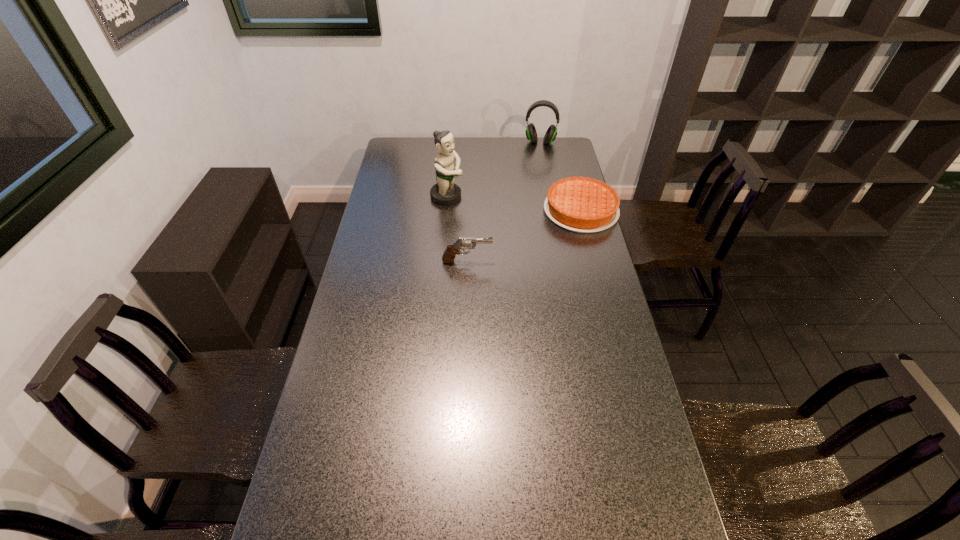
The height and width of the screenshot is (540, 960). In order to click on free space between the pistol and the tallest object in this screenshot , I will do `click(457, 229)`.

Where is `blank region between the pie and the pistol`? This screenshot has height=540, width=960. blank region between the pie and the pistol is located at coordinates (524, 236).

Identify which object is the closest to the tallest object. Please provide its 2D coordinates. Your answer should be formatted as a tuple, i.e. [(x, y)], where the tuple contains the x and y coordinates of a point satisfying the conditions above.

[(463, 243)]

Point out which object is positioned as the third nearest to the pistol. Please provide its 2D coordinates. Your answer should be formatted as a tuple, i.e. [(x, y)], where the tuple contains the x and y coordinates of a point satisfying the conditions above.

[(531, 134)]

What are the coordinates of `free spot that satisfies the following two spatial constraints: 1. on the back side of the second tallest object; 2. on the left side of the tallest object` in the screenshot? It's located at (452, 143).

Where is `free space that satisfies the following two spatial constraints: 1. on the back side of the headset; 2. on the right side of the tallest object`? The width and height of the screenshot is (960, 540). free space that satisfies the following two spatial constraints: 1. on the back side of the headset; 2. on the right side of the tallest object is located at coordinates (452, 143).

Locate an element on the screen. The image size is (960, 540). vacant area in the image that satisfies the following two spatial constraints: 1. on the front side of the pistol; 2. at the barrel of the figurine is located at coordinates (442, 261).